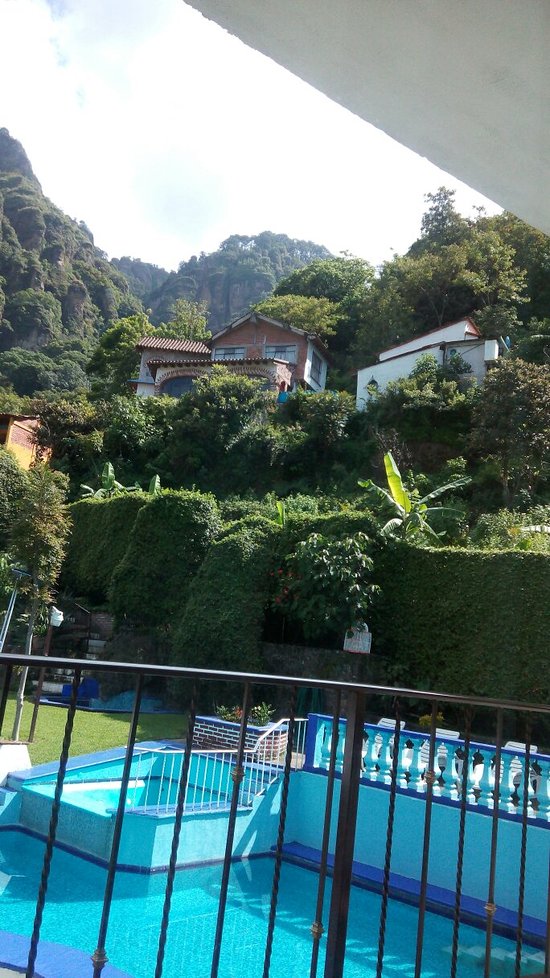
This screenshot has width=550, height=978. I want to click on hand rail, so click(147, 748), click(207, 750), click(272, 724).